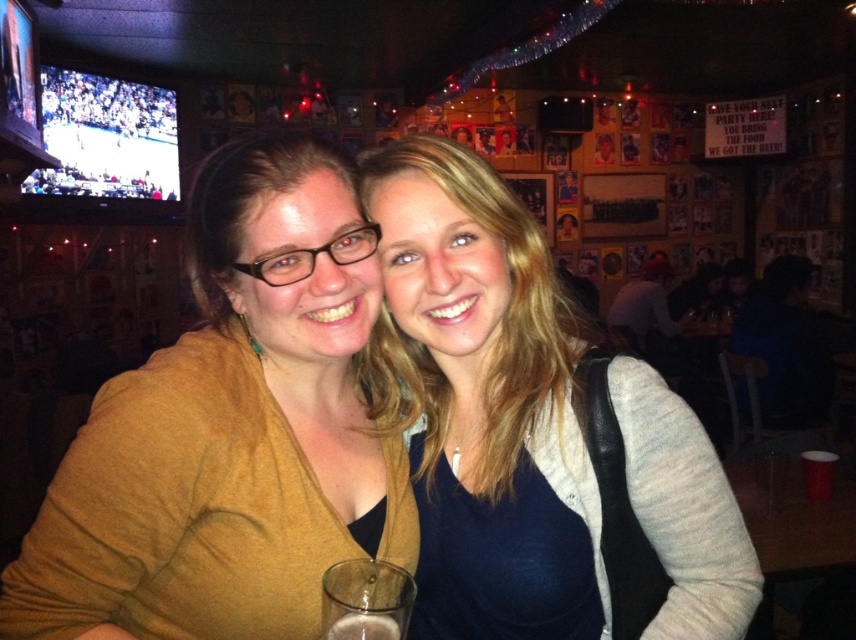
You are a photographer trying to capture a clear shot of the translucent glass at lower center without the matte yellow sweater at center blocking it. Can you adjust your angle to do so?

The matte yellow sweater at center is taller than the translucent glass at lower center, so adjusting your angle slightly downward might allow you to capture the translucent glass at lower center without obstruction from the sweater.

You are a bartender preparing to place a new drink order on the table. The drink will be served in a tall glass that is 12 inches high. Considering the objects on the table, will the matte yellow sweater at center and the clear glass at lower center allow enough vertical space for the new glass?

The matte yellow sweater at center is taller than the clear glass at lower center, so the vertical space may be sufficient as long as the sweater does not block the area. However, the height of the sweater itself isn not specified, so it is uncertain if the 12 inch glass will fit without interference.

You are a waiter at a bar. You need to place a 12 inch long bottle of wine between the matte gray sweater at center and the translucent glass at lower center. Is there enough space?

The distance between the matte gray sweater at center and the translucent glass at lower center is 13.65 inches. Since the bottle is 12 inches long, there is enough space to place it between them.